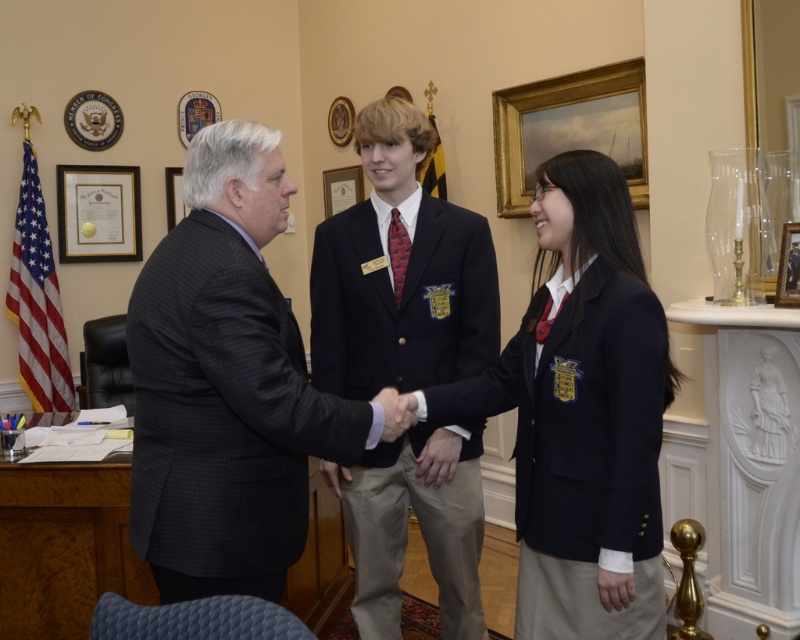
Question: Which of the following is the closest to the observer?

Choices:
 (A) matte gold picture frame at center
 (B) gold-framed certificate at upper left
 (C) dark gray suit at center
 (D) navy blue blazer at center

Answer: (C)

Question: Which object is farther from the camera taking this photo?

Choices:
 (A) navy blue blazer at center
 (B) matte gold picture frame at center

Answer: (B)

Question: In this image, where is navy blue blazer at center located relative to matte gold picture frame at center?

Choices:
 (A) left
 (B) right

Answer: (B)

Question: Is navy blue blazer at center to the right of dark blue blazer at center from the viewer's perspective?

Choices:
 (A) yes
 (B) no

Answer: (A)

Question: Which point appears farthest from the camera in this image?

Choices:
 (A) (392, 252)
 (B) (122, 212)
 (C) (582, 276)
 (D) (400, 116)

Answer: (B)

Question: Does dark blue blazer at center come behind wooden picture frame at center?

Choices:
 (A) no
 (B) yes

Answer: (A)